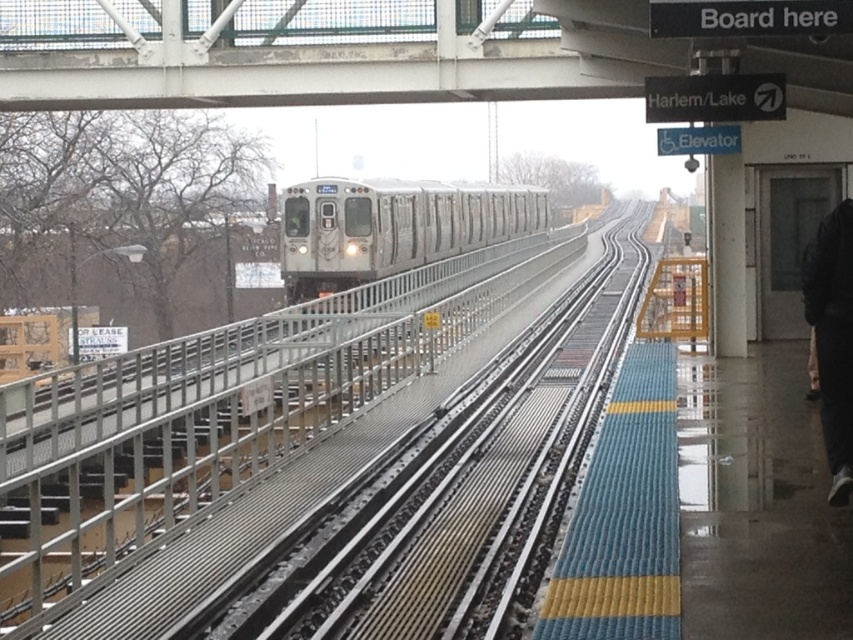
You are a passenger waiting at the train station platform. You see the silver metallic train at center and the black fabric pants at lower right. Which object is closer to the edge of the platform?

The black fabric pants at lower right are closer to the edge of the platform because the silver metallic train at center is to the left of the black fabric pants at lower right, meaning the black fabric pants are positioned further right, which is near the edge.